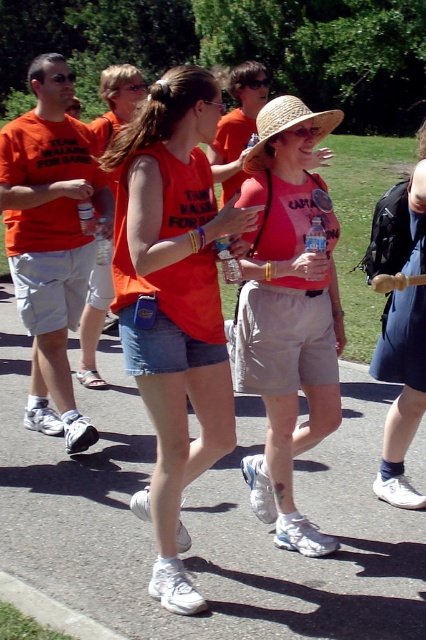
Question: Which object is positioned closest to the matte orange t-shirt at left?

Choices:
 (A) strawmaterial/texturehat at center
 (B) matte red tank top at center

Answer: (A)

Question: Does matte orange t-shirt at left appear under strawmaterial/texturehat at center?

Choices:
 (A) no
 (B) yes

Answer: (A)

Question: Does orange cotton tank top at center lie behind matte red tank top at center?

Choices:
 (A) no
 (B) yes

Answer: (A)

Question: Considering the relative positions of matte orange t-shirt at left and denim shorts at center in the image provided, where is matte orange t-shirt at left located with respect to denim shorts at center?

Choices:
 (A) left
 (B) right

Answer: (A)

Question: Which point is closer to the camera?

Choices:
 (A) matte red tank top at center
 (B) orange cotton tank top at center

Answer: (B)

Question: Which object appears closest to the camera in this image?

Choices:
 (A) matte orange t-shirt at left
 (B) matte red tank top at center
 (C) orange cotton tank top at center
 (D) strawmaterial/texturehat at center

Answer: (C)